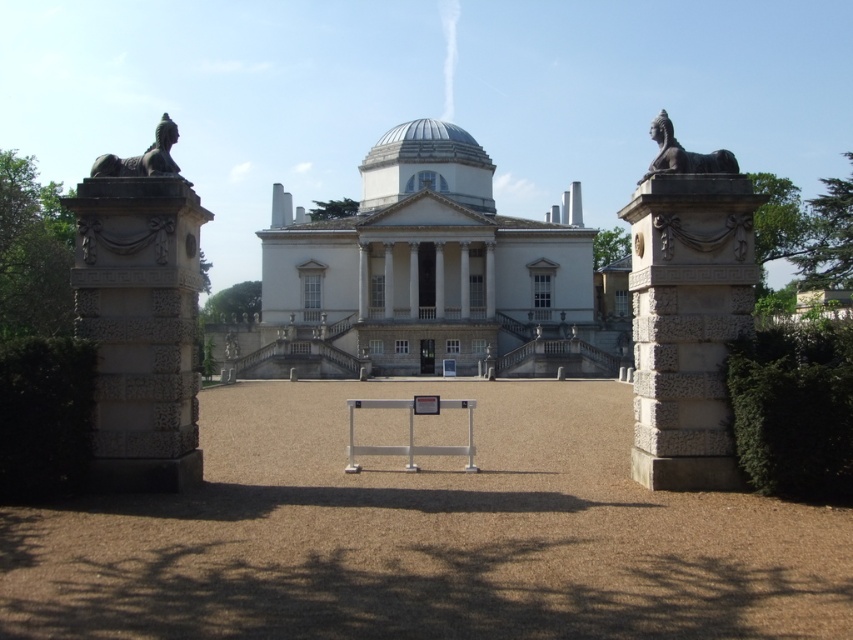
From the picture: You are standing at the coordinates of point 0.000, 0.000. You want to go to the white marble mansion at center. Which direction should you move in?

You should move towards the white marble mansion at center located at point (422, 275), which is northeast of your current position at (0, 0).

You are standing in front of the white marble mansion at center and the carved stone column at left. Which structure is closer to your left side?

The carved stone column at left is closer to your left side because the white marble mansion at center is positioned on the right side of it.

From the picture: You are standing in front of the grand neoclassical building and want to take a photo. You notice two points marked on your camera screen at coordinates point (450,317) and point (677,394). Which point is closer to your camera lens?

Point (450,317) is further to the camera than point (677,394), so the point closer to the camera lens is point (677,394).